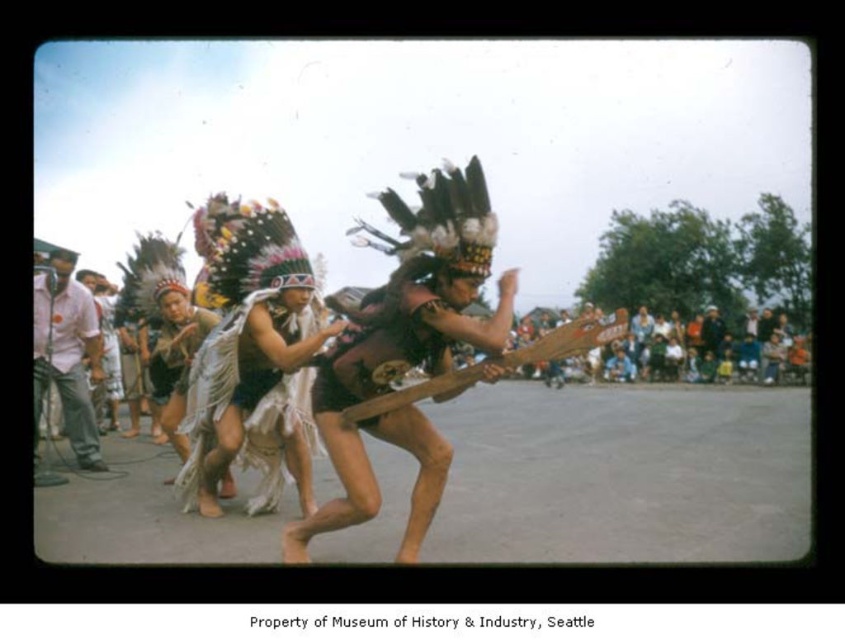
Question: From the image, what is the correct spatial relationship of white fringed fabric at center in relation to white cotton shirt at left?

Choices:
 (A) left
 (B) right

Answer: (B)

Question: Is white fringed fabric at center wider than white cotton shirt at left?

Choices:
 (A) no
 (B) yes

Answer: (B)

Question: Which point is farther to the camera?

Choices:
 (A) (74, 348)
 (B) (306, 464)

Answer: (A)

Question: Does white fringed fabric at center have a smaller size compared to white cotton shirt at left?

Choices:
 (A) no
 (B) yes

Answer: (B)

Question: Which point appears closest to the camera in this image?

Choices:
 (A) (224, 397)
 (B) (64, 396)

Answer: (A)

Question: Which object appears farthest from the camera in this image?

Choices:
 (A) white cotton shirt at left
 (B) white fringed fabric at center

Answer: (A)